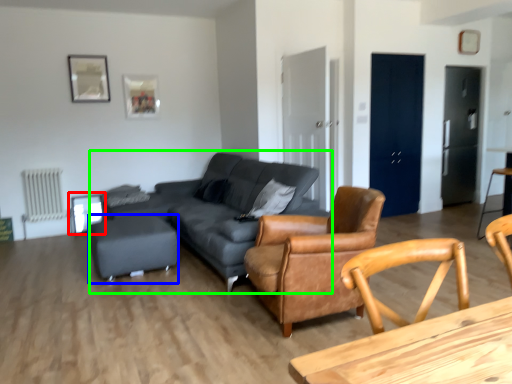
Question: Which object is the closest to the side table (highlighted by a red box)? Choose among these: bar stool (highlighted by a blue box) or studio couch (highlighted by a green box).

Choices:
 (A) bar stool
 (B) studio couch

Answer: (A)